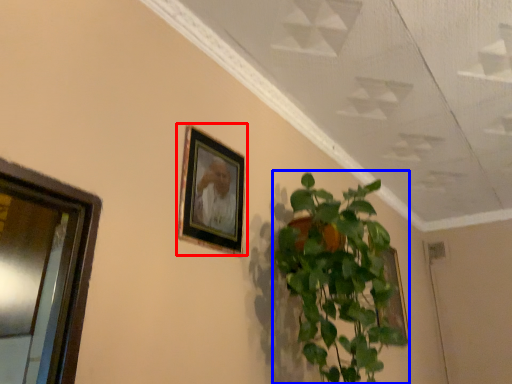
Question: Which point is closer to the camera, picture frame (highlighted by a red box) or houseplant (highlighted by a blue box)?

Choices:
 (A) picture frame
 (B) houseplant

Answer: (B)